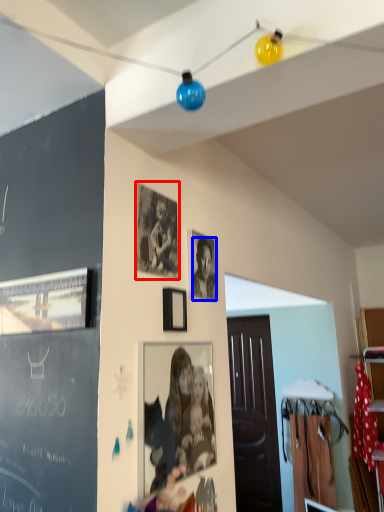
Question: Which object appears closest to the camera in this image, picture frame (highlighted by a red box) or person (highlighted by a blue box)?

Choices:
 (A) picture frame
 (B) person

Answer: (A)